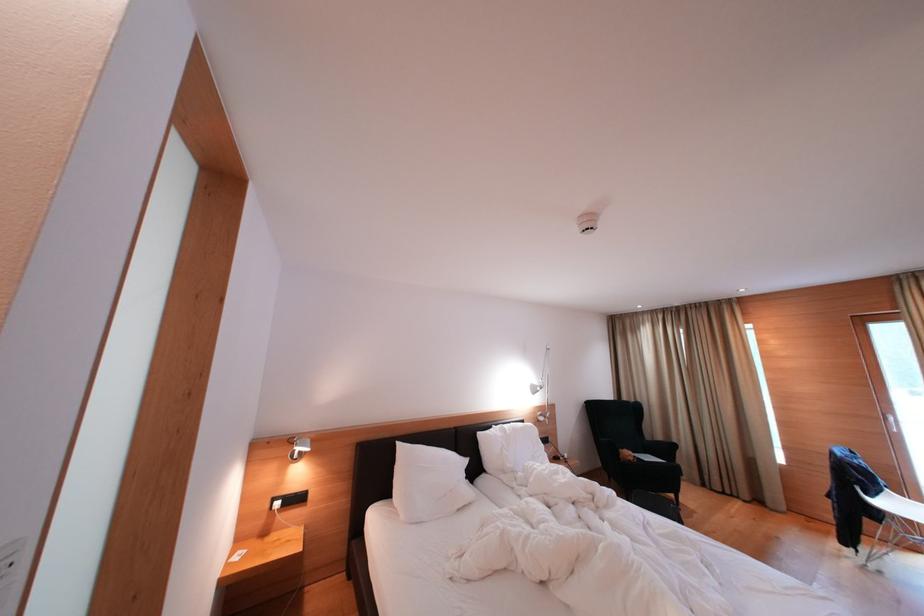
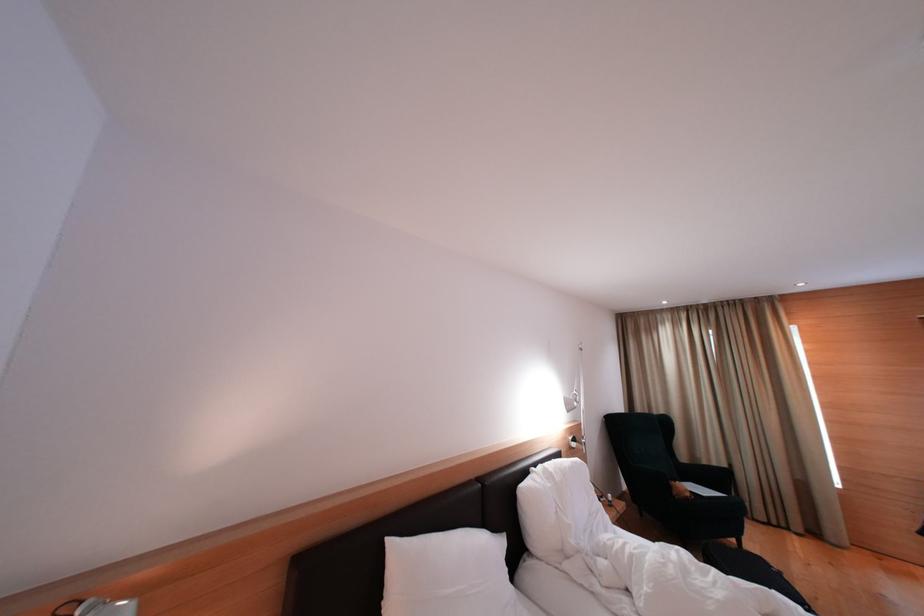
In a continuous first-person perspective shot, in which direction is the camera moving?

The movement direction of the cameraman is left, forward.